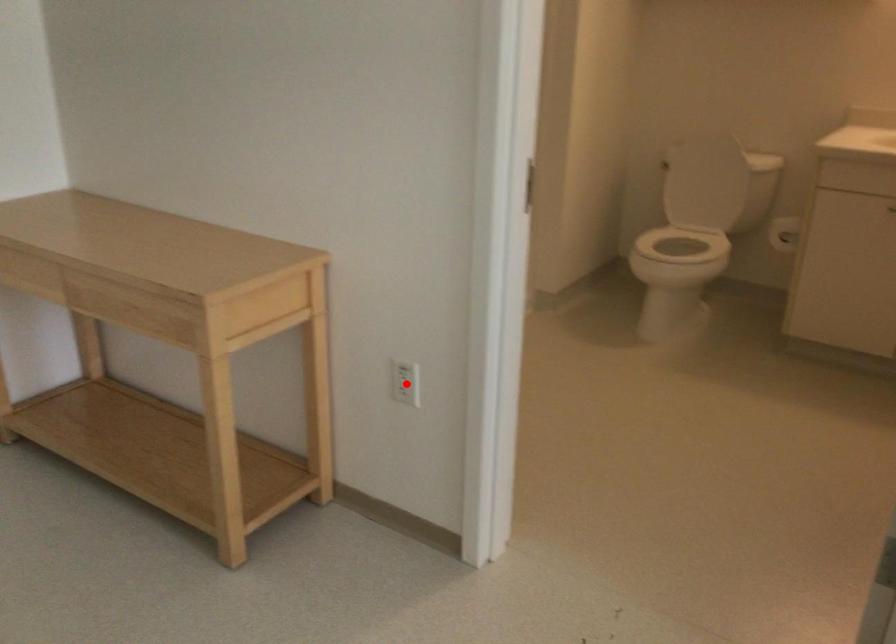
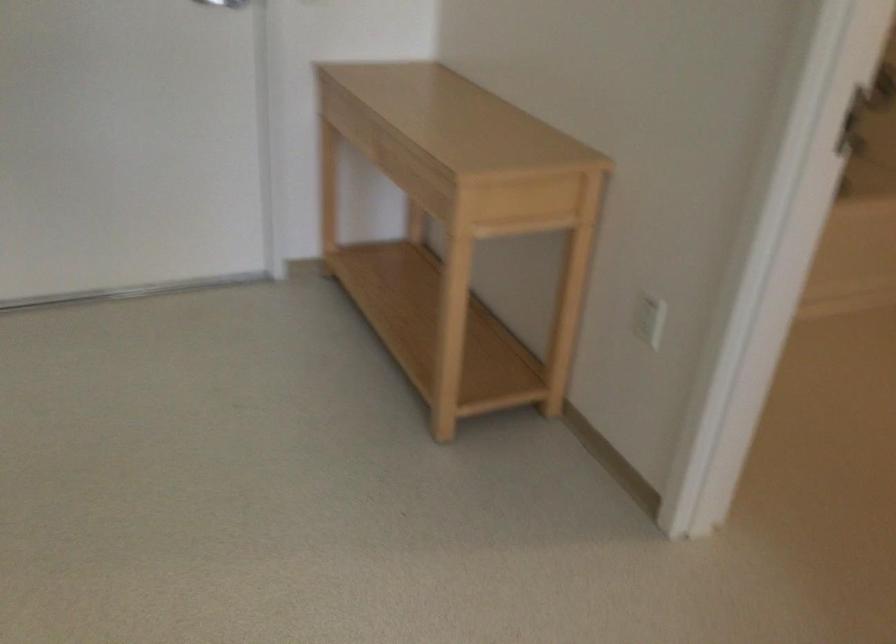
Question: I am providing you with two images of the same scene from different viewpoints. Given a red point in image1, look at the same physical point in image2. Is it:

Choices:
 (A) Closer to the viewpoint
 (B) Farther from the viewpoint

Answer: (A)